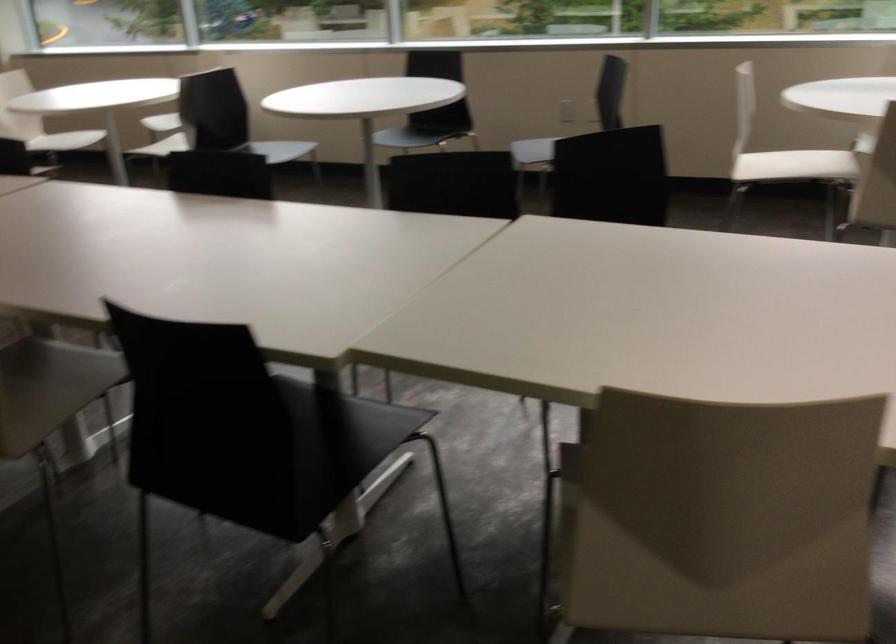
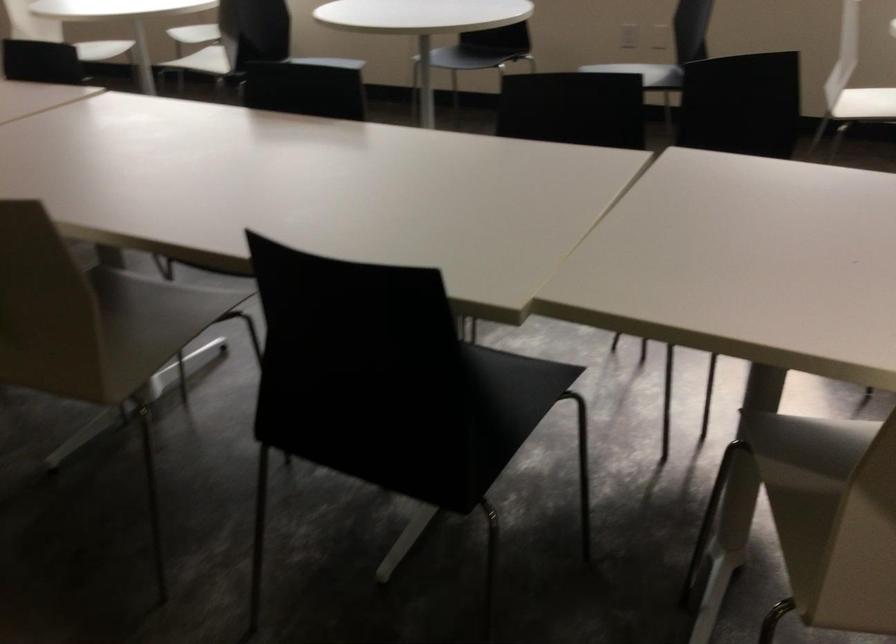
Find the pixel in the second image that matches pixel 574 526 in the first image.

(831, 516)